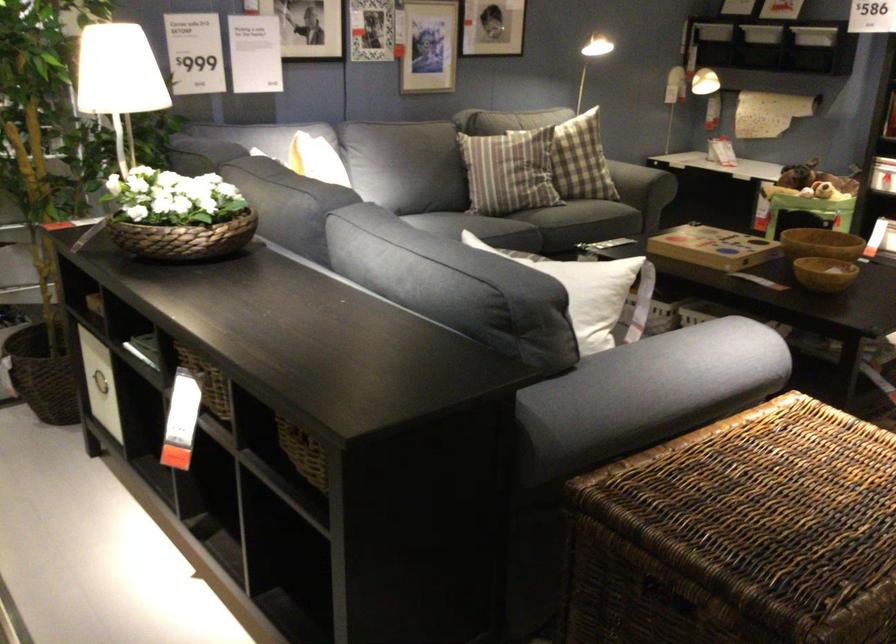
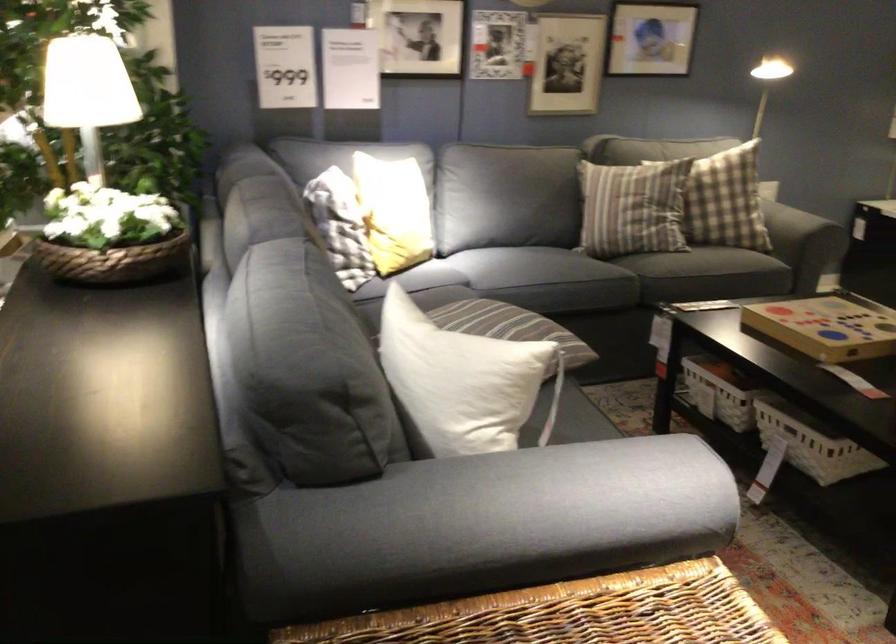
Where in the second image is the point corresponding to [677,368] from the first image?

(528, 500)